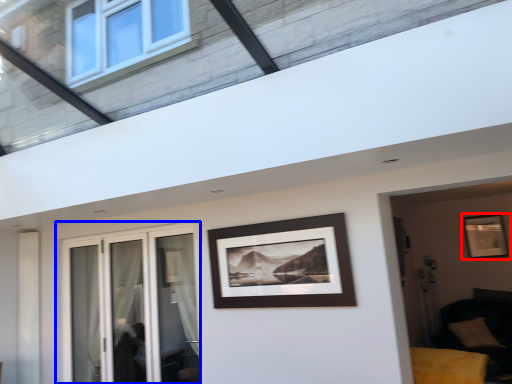
Question: Which point is further to the camera, picture frame (highlighted by a red box) or window (highlighted by a blue box)?

Choices:
 (A) picture frame
 (B) window

Answer: (A)